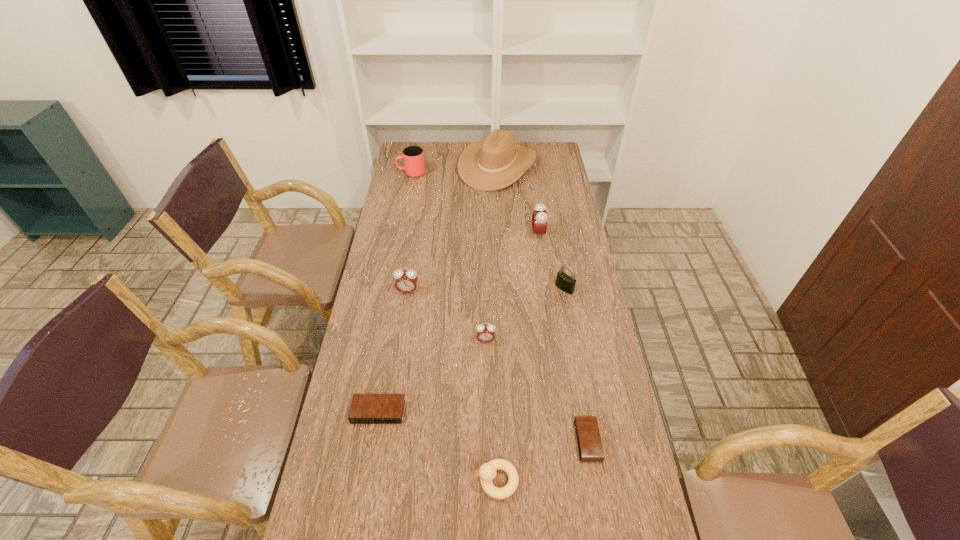
Locate an element on the screen. free space located on the clock face of the third alarm clock from right to left is located at coordinates (487, 431).

Identify the location of free space located 0.180m at the beak of the duckling. (406, 481).

Find the location of a particular element. vacant space located at the beak of the duckling is located at coordinates (452, 481).

Locate an element on the screen. The height and width of the screenshot is (540, 960). vacant position located 0.370m at the beak of the duckling is located at coordinates (334, 481).

I want to click on vacant space situated 0.190m on the front face of the bigger black alarm clock, so click(x=364, y=494).

You are a GUI agent. You are given a task and a screenshot of the screen. Output one action in this format:
    pyautogui.click(x=<x>, y=<y>)
    Task: Click on the vacant area situated on the front face of the right black alarm clock
    The height and width of the screenshot is (540, 960).
    Given the screenshot: What is the action you would take?
    click(502, 441)

At what (x,y) coordinates should I click in order to perform the action: click on vacant region located 0.320m on the front face of the right black alarm clock. Please return your answer as a coordinate pair (x, y). This screenshot has height=540, width=960. Looking at the image, I should click on click(463, 441).

You are a GUI agent. You are given a task and a screenshot of the screen. Output one action in this format:
    pyautogui.click(x=<x>, y=<y>)
    Task: Click on the free space located on the front face of the right black alarm clock
    The width and height of the screenshot is (960, 540).
    Given the screenshot: What is the action you would take?
    pyautogui.click(x=548, y=441)

Locate an element on the screen. The image size is (960, 540). object that is positioned at the far edge is located at coordinates (489, 164).

Locate an element on the screen. This screenshot has height=540, width=960. cup that is positioned at the left edge is located at coordinates (413, 157).